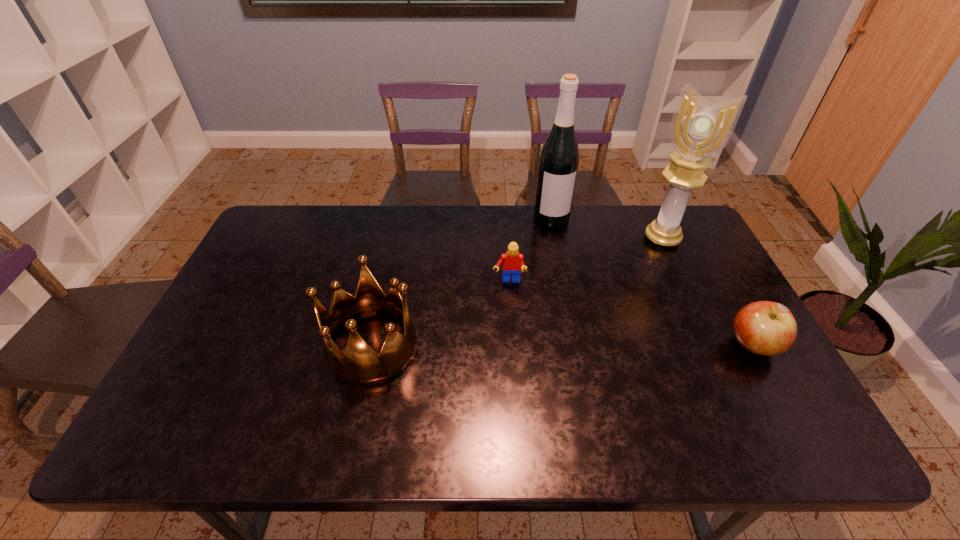
The height and width of the screenshot is (540, 960). What are the coordinates of `free space on the desktop that is between the third tallest object and the apple and is positioned on the label of the wine bottle` in the screenshot? It's located at (585, 346).

Locate an element on the screen. This screenshot has height=540, width=960. vacant space on the desktop that is between the third shortest object and the apple and is positioned on the front-facing side of the second object from left to right is located at coordinates (511, 347).

In order to click on free space on the desktop that is between the third shortest object and the apple and is positioned on the front-facing side of the award in this screenshot , I will do `click(598, 346)`.